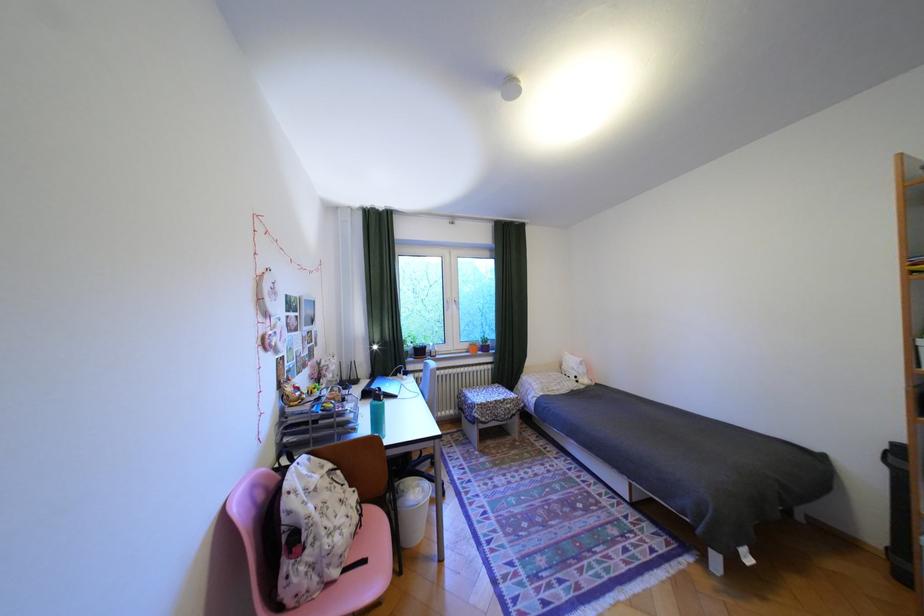
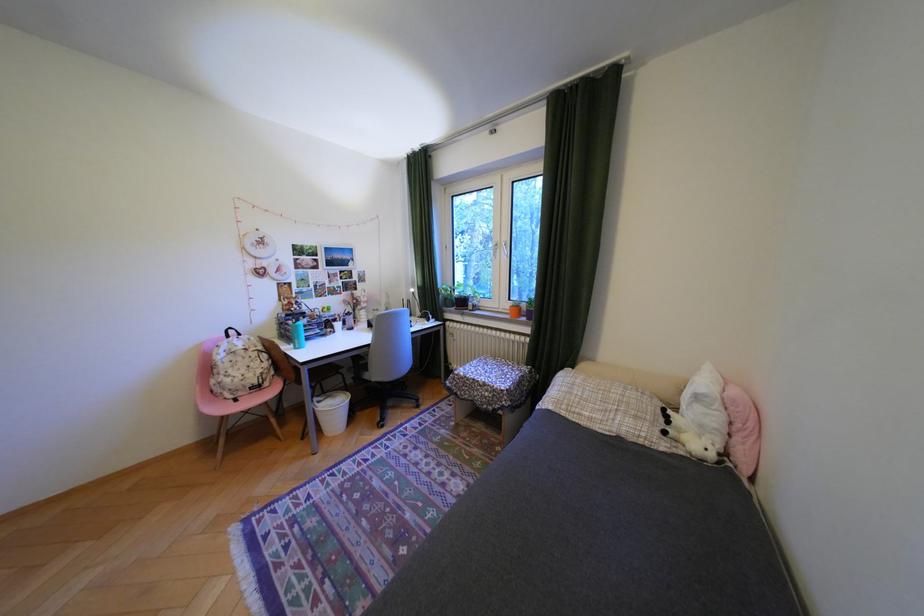
In the second image, find the point that corresponds to point 495,419 in the first image.

(470, 392)